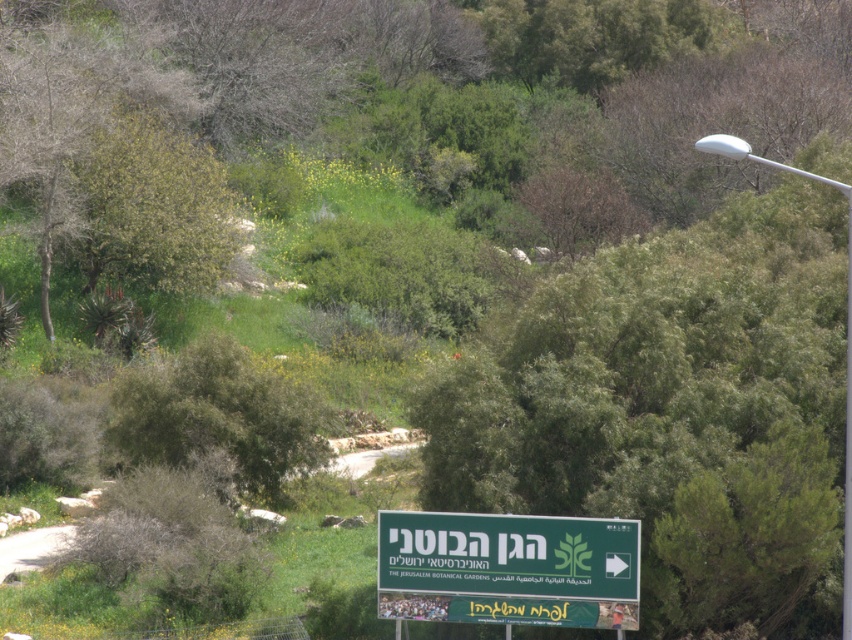
Consider the image. Is the position of green leafy tree at center less distant than that of green plastic sign at lower center?

No, green leafy tree at center is behind green plastic sign at lower center.

Between point (793, 397) and point (550, 550), which one is positioned behind?

The point (793, 397) is more distant.

Describe the element at coordinates (675, 410) in the screenshot. I see `green leafy tree at center` at that location.

Identify the location of green leafy tree at center. (675, 410).